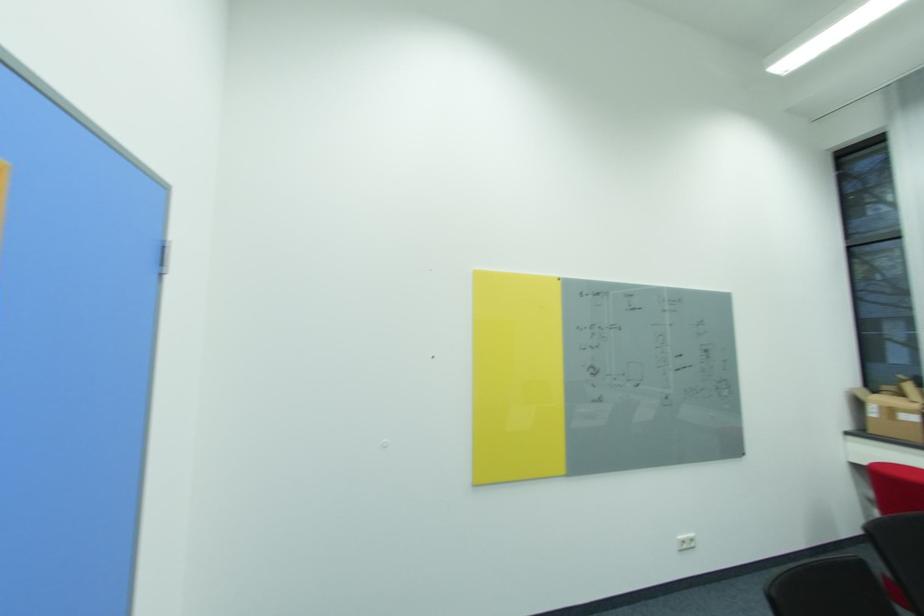
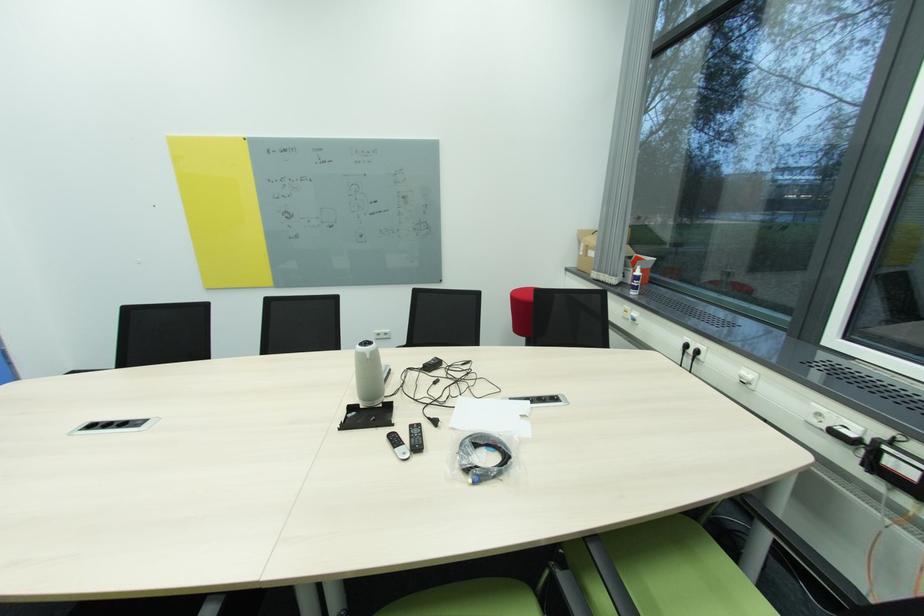
Where in the second image is the point corresponding to (895,411) from the first image?

(591, 249)